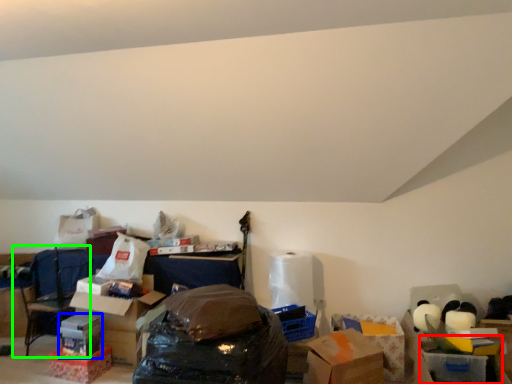
Question: Based on their relative distances, which object is farther from storage box (highlighted by a red box)? Choose from storage box (highlighted by a blue box) and armchair (highlighted by a green box).

Choices:
 (A) storage box
 (B) armchair

Answer: (B)